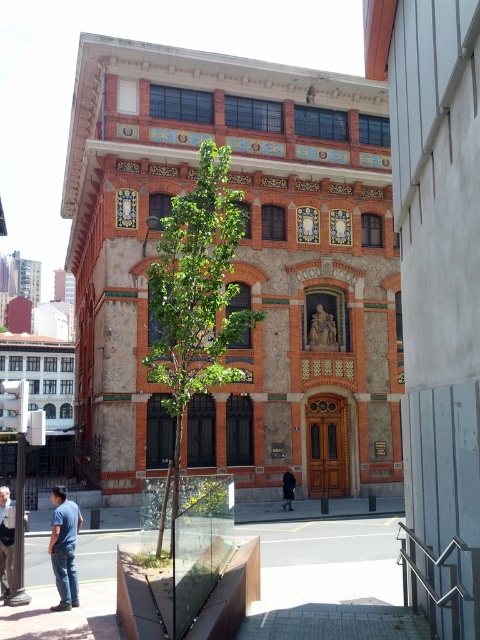
Question: Which of the following is the closest to the observer?

Choices:
 (A) green leafy tree at center
 (B) blue denim jeans at lower left
 (C) dark gray coat at center
 (D) denim jacket at lower left

Answer: (A)

Question: Is blue denim jeans at lower left above denim jacket at lower left?

Choices:
 (A) yes
 (B) no

Answer: (B)

Question: Does denim jacket at lower left appear on the right side of dark gray coat at center?

Choices:
 (A) yes
 (B) no

Answer: (B)

Question: Which object is closer to the camera taking this photo?

Choices:
 (A) dark gray coat at center
 (B) smooth concrete pavement at lower center
 (C) green leafy tree at center

Answer: (C)

Question: Does green leafy tree at center appear on the right side of blue denim jeans at lower left?

Choices:
 (A) no
 (B) yes

Answer: (B)

Question: Estimate the real-world distances between objects in this image. Which object is closer to the smooth concrete pavement at lower center?

Choices:
 (A) green leafy tree at center
 (B) dark gray coat at center
 (C) denim jacket at lower left
 (D) blue denim jeans at lower left

Answer: (C)